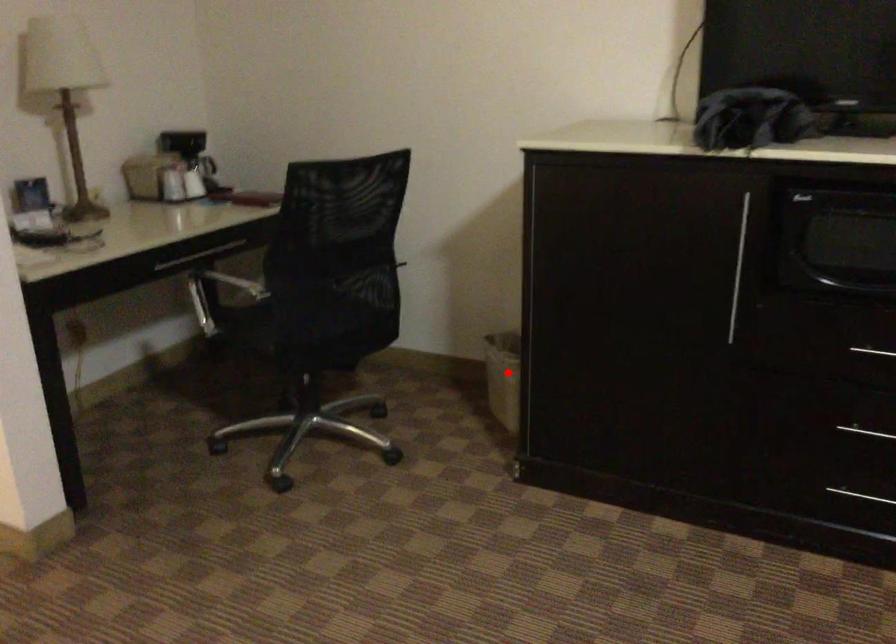
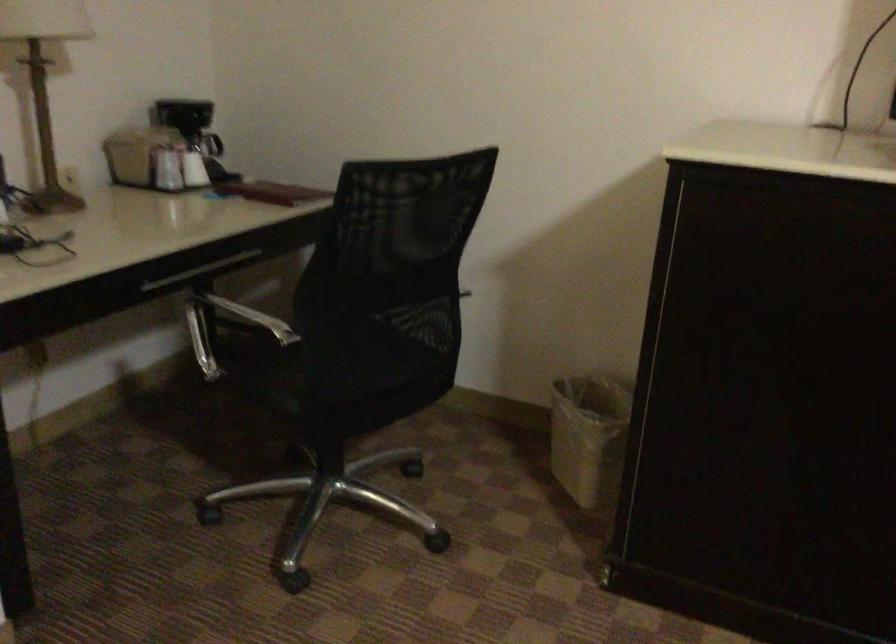
In the second image, find the point that corresponds to the highlighted location in the first image.

(589, 437)